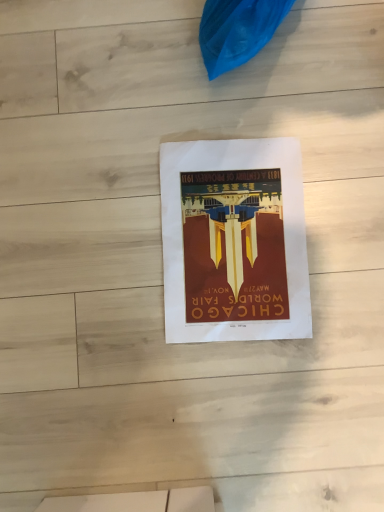
At what (x,y) coordinates should I click in order to perform the action: click on matte paper poster at center. Please return your answer as a coordinate pair (x, y). The width and height of the screenshot is (384, 512). Looking at the image, I should click on (234, 241).

Describe the element at coordinates (234, 241) in the screenshot. This screenshot has height=512, width=384. I see `matte paper poster at center` at that location.

What are the coordinates of `matte paper poster at center` in the screenshot? It's located at (x=234, y=241).